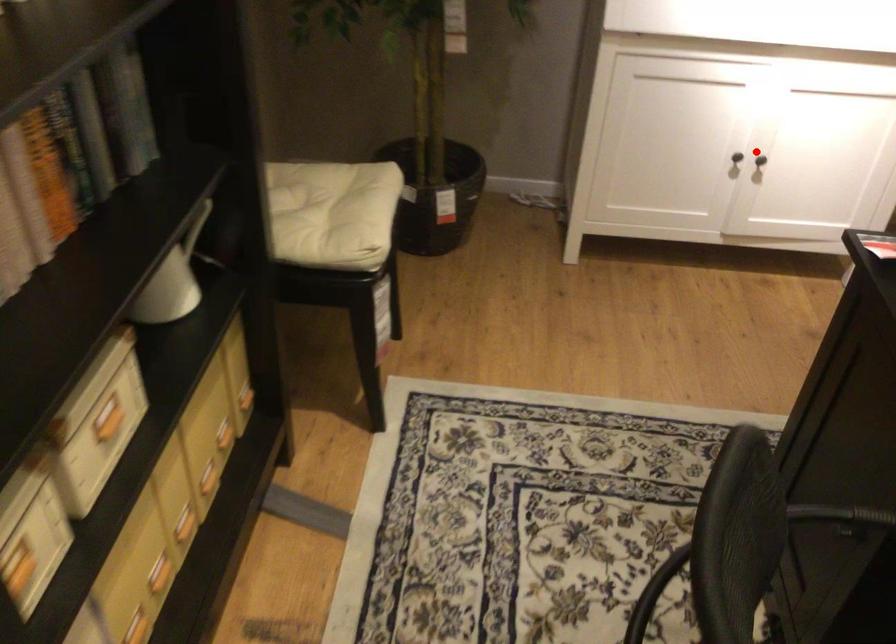
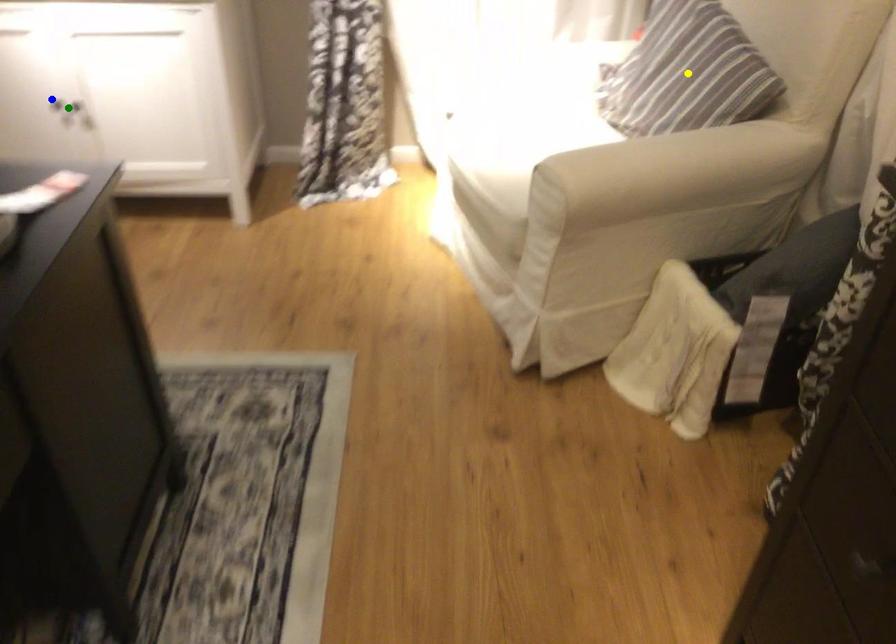
Question: I am providing you with two images of the same scene from different viewpoints. A red point is marked on the first image. You are given multiple points on the second image. In image 2, which mark is for the same physical point as the one in image 1?

Choices:
 (A) yellow point
 (B) green point
 (C) blue point

Answer: (B)